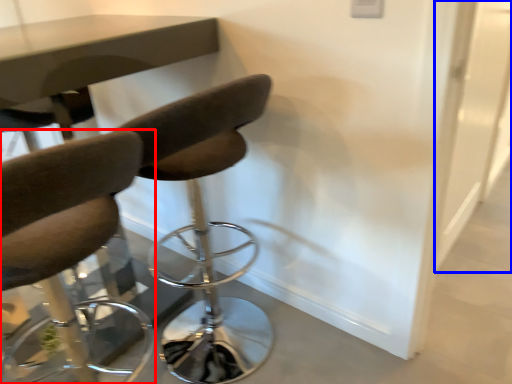
Question: Among these objects, which one is nearest to the camera, chair (highlighted by a red box) or glass door (highlighted by a blue box)?

Choices:
 (A) chair
 (B) glass door

Answer: (A)